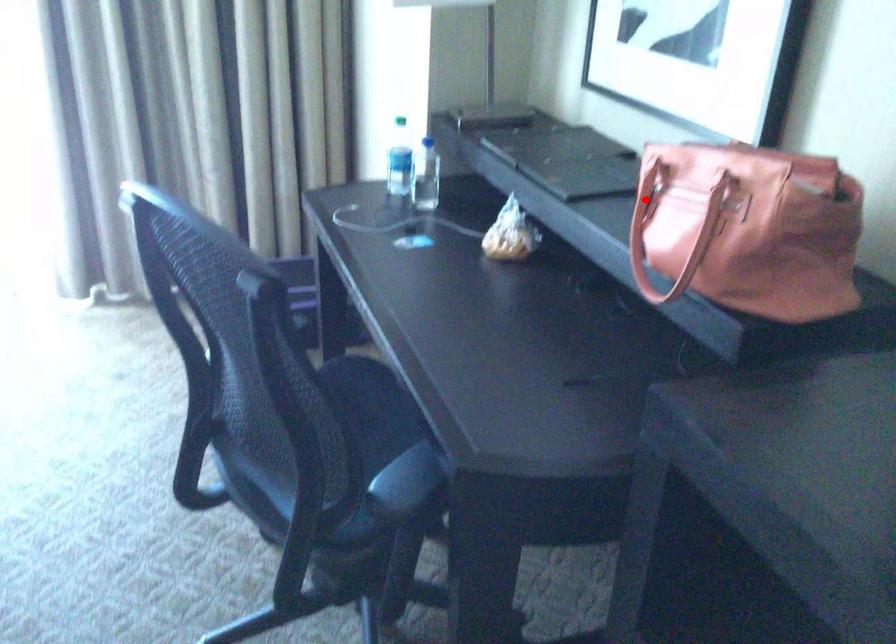
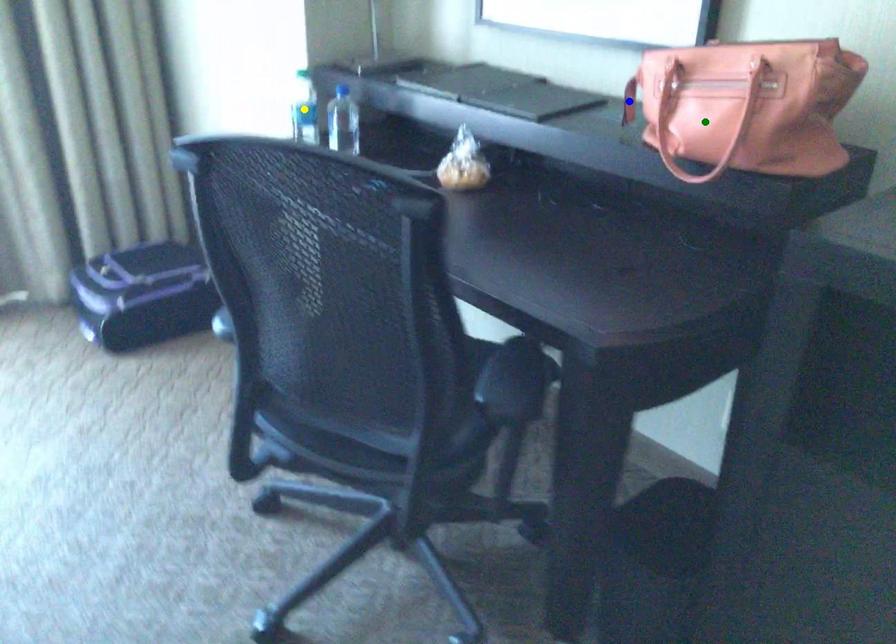
Question: I am providing you with two images of the same scene from different viewpoints. A red point is marked on the first image. You are given multiple points on the second image. Which mark in image 2 goes with the point in image 1?

Choices:
 (A) yellow point
 (B) green point
 (C) blue point

Answer: (C)